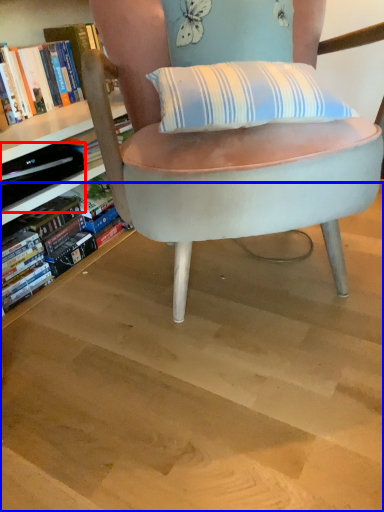
Question: Among these objects, which one is farthest to the camera, paperback book (highlighted by a red box) or stairwell (highlighted by a blue box)?

Choices:
 (A) paperback book
 (B) stairwell

Answer: (A)